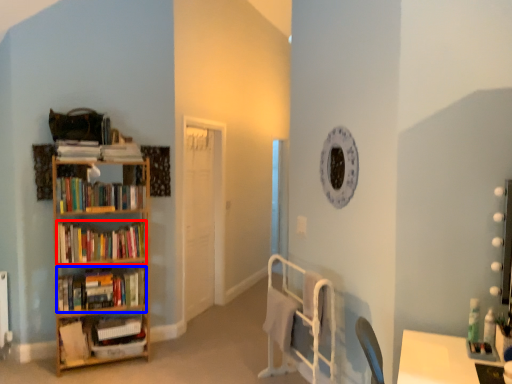
Question: Which object appears farthest to the camera in this image, book (highlighted by a red box) or book (highlighted by a blue box)?

Choices:
 (A) book
 (B) book

Answer: (B)